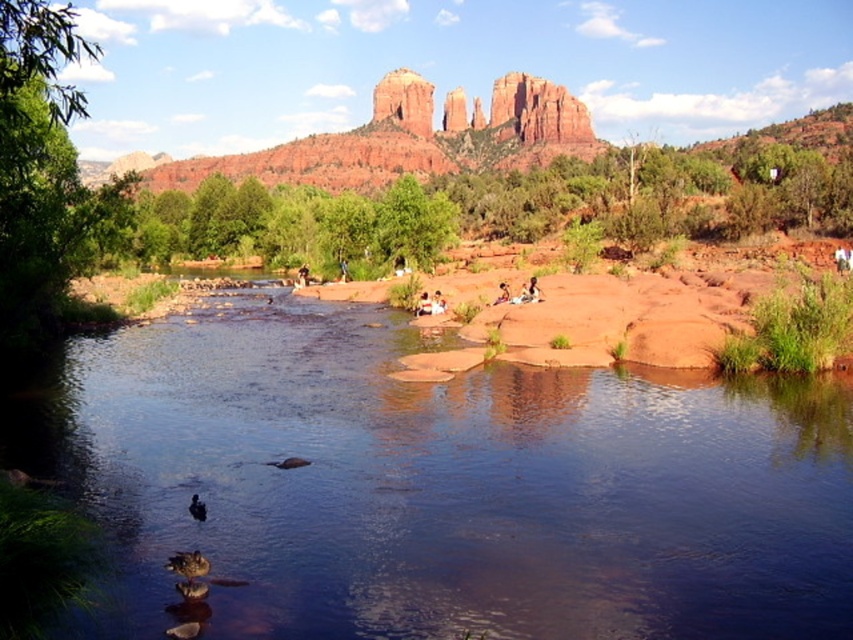
You are a photographer planning to capture the scene with the clear water at center and the smooth skin person at center. Since you want to focus on the person, which object should you move closer to and why?

You should move closer to the smooth skin person at center because the clear water at center is larger in size, so moving closer to the person will help bring them into focus while reducing the prominence of the water.